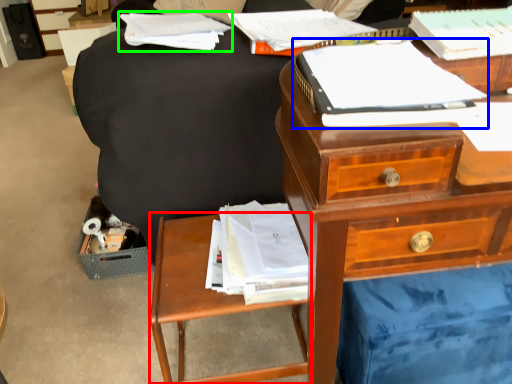
Question: Which object is the farthest from nightstand (highlighted by a red box)? Choose among these: paperback book (highlighted by a blue box) or book (highlighted by a green box).

Choices:
 (A) paperback book
 (B) book

Answer: (B)